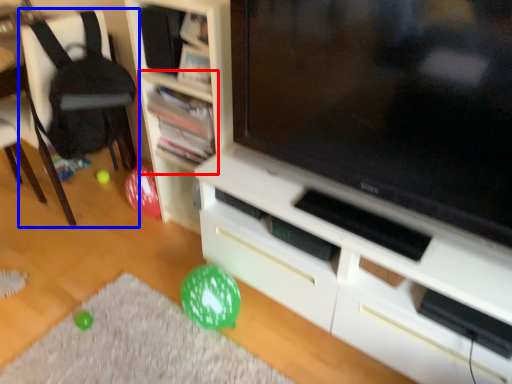
Question: Which of the following is the farthest to the observer, shelf (highlighted by a red box) or chair (highlighted by a blue box)?

Choices:
 (A) shelf
 (B) chair

Answer: (A)